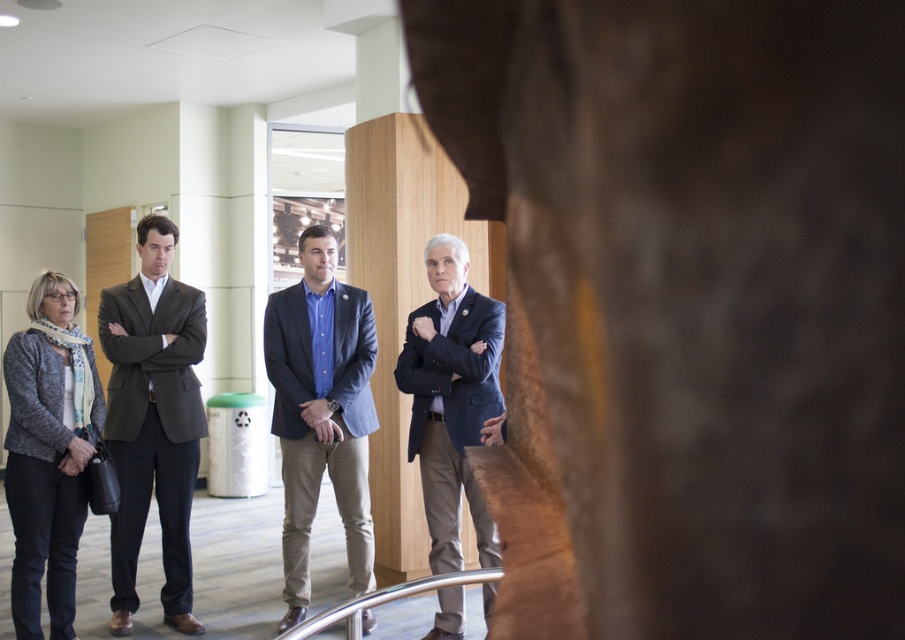
You are standing in the room and see two points marked in the image. The first point is at coordinate point (148, 460) and the second is at point (454, 609). Which point is closer to you?

Point (148, 460) is closer to you because it is further to the viewer than point (454, 609).

You are standing in the room and want to hand a document to the person wearing the matte blue shirt at center. If you are currently 5 meters away from them, can you reach them without moving closer?

The matte blue shirt at center is 4.06 meters away from the viewer. Since you are 5 meters away, you are farther than the required distance. You need to move closer to reach them.